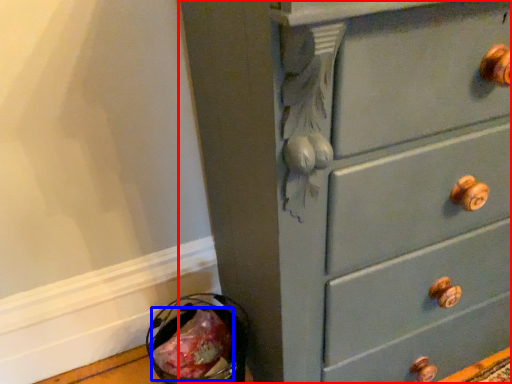
Question: Which object appears closest to the camera in this image, chest of drawers (highlighted by a red box) or food (highlighted by a blue box)?

Choices:
 (A) chest of drawers
 (B) food

Answer: (A)